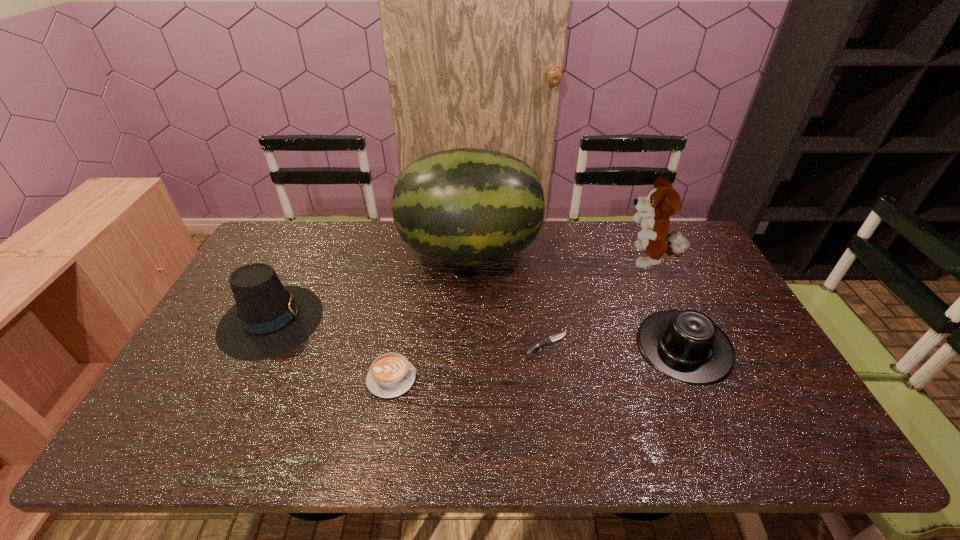
I want to click on dress hat positioned at the right edge, so click(x=685, y=345).

This screenshot has height=540, width=960. I want to click on object that is at the far right corner, so click(663, 201).

Where is `vacant space at the far edge of the desktop`? vacant space at the far edge of the desktop is located at coordinates (633, 231).

You are a GUI agent. You are given a task and a screenshot of the screen. Output one action in this format:
    pyautogui.click(x=<x>, y=<y>)
    Task: Click on the vacant area at the near edge
    This screenshot has width=960, height=540.
    Given the screenshot: What is the action you would take?
    pyautogui.click(x=632, y=421)

The width and height of the screenshot is (960, 540). In the image, there is a desktop. What are the coordinates of `free region at the left edge` in the screenshot? It's located at (229, 385).

Identify the location of vacant space at the right edge. Image resolution: width=960 pixels, height=540 pixels. (713, 276).

The image size is (960, 540). What are the coordinates of `vacant space at the far right corner of the desktop` in the screenshot? It's located at (675, 229).

In the image, there is a desktop. Where is `vacant space at the near right corner`? The height and width of the screenshot is (540, 960). vacant space at the near right corner is located at coordinates (811, 443).

Locate an element on the screen. empty location between the taller dress hat and the cappuccino is located at coordinates (332, 349).

Find the location of a particular element. The image size is (960, 540). vacant space in between the fifth shortest object and the right dress hat is located at coordinates (666, 304).